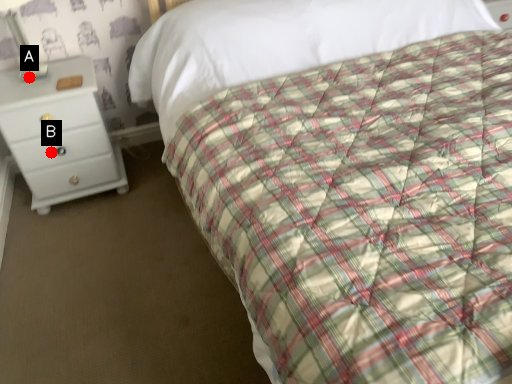
Question: Two points are circled on the image, labeled by A and B beside each circle. Which point is closer to the camera?

Choices:
 (A) A is closer
 (B) B is closer

Answer: (A)